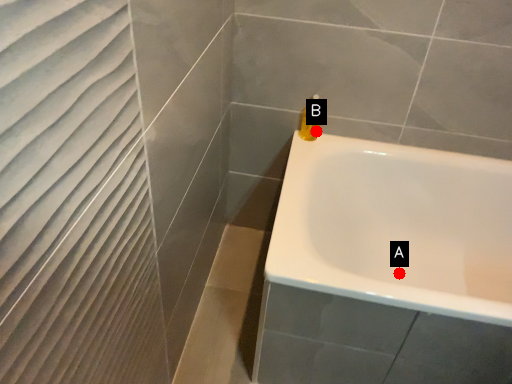
Question: Two points are circled on the image, labeled by A and B beside each circle. Among these points, which one is farthest from the camera?

Choices:
 (A) A is further
 (B) B is further

Answer: (A)